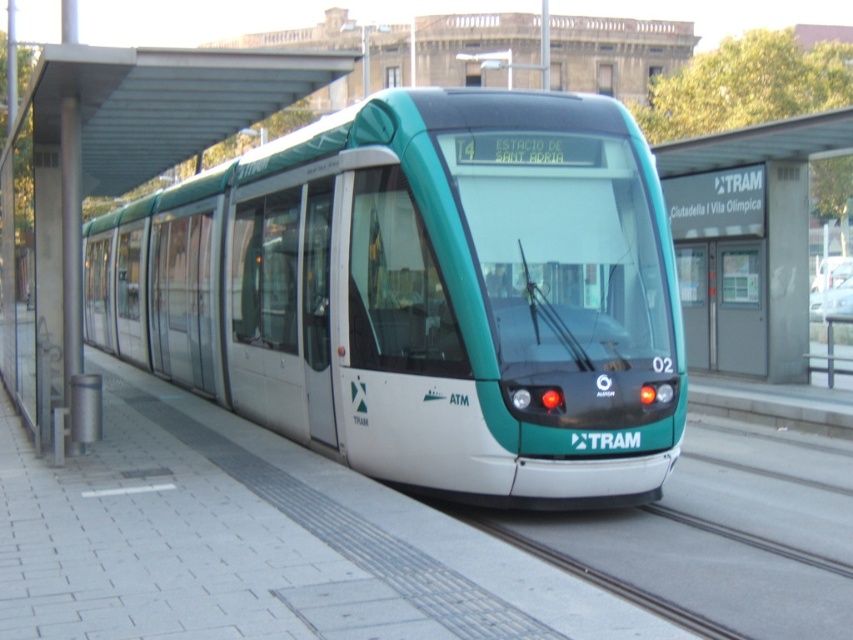
Between point (335, 339) and point (51, 320), which one is positioned behind?

The point (51, 320) is more distant.

Is point (234, 250) positioned after point (45, 435)?

Yes, point (234, 250) is behind point (45, 435).

Find the location of a particular element. This screenshot has width=853, height=640. green matte tram at center is located at coordinates (421, 292).

Find the location of a particular element. Image resolution: width=853 pixels, height=640 pixels. green matte tram at center is located at coordinates (x=421, y=292).